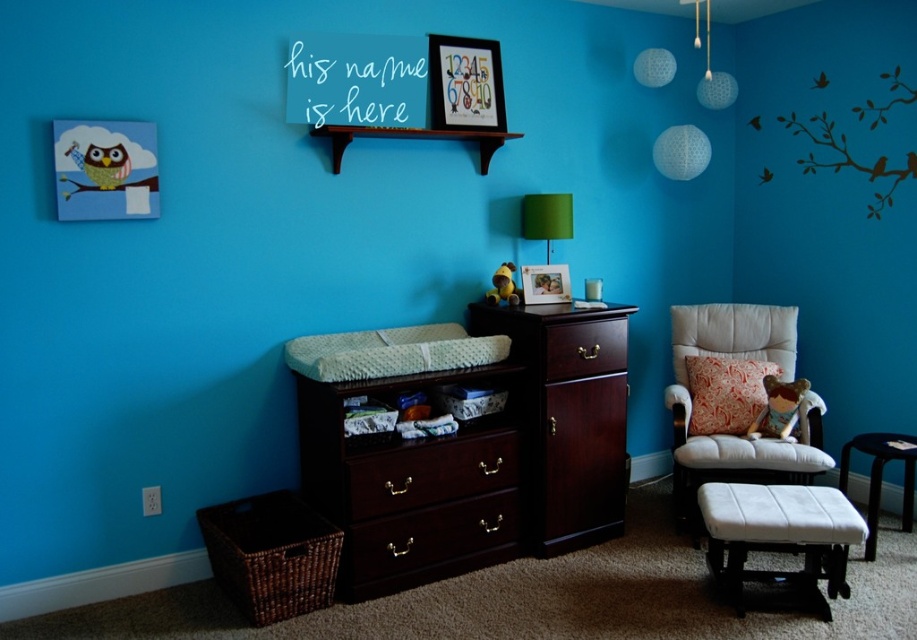
Question: Among these points, which one is farthest from the camera?

Choices:
 (A) (461, 365)
 (B) (675, 404)
 (C) (615, 360)
 (D) (874, 547)

Answer: (B)

Question: Which point appears farthest from the camera in this image?

Choices:
 (A) (505, 273)
 (B) (617, 344)
 (C) (551, 228)

Answer: (C)

Question: Considering the relative positions of white textured mattress at center and yellow plush toy at center in the image provided, where is white textured mattress at center located with respect to yellow plush toy at center?

Choices:
 (A) below
 (B) above

Answer: (A)

Question: Among these objects, which one is farthest from the camera?

Choices:
 (A) white textured mattress at center
 (B) white leather armchair at right
 (C) green fabric lampshade at center
 (D) dark wood drawer at center

Answer: (C)

Question: Is white leather armchair at right to the right of yellow plush toy at center from the viewer's perspective?

Choices:
 (A) no
 (B) yes

Answer: (B)

Question: Is dark wood drawer at center to the right of floral fabric pillow at right from the viewer's perspective?

Choices:
 (A) yes
 (B) no

Answer: (B)